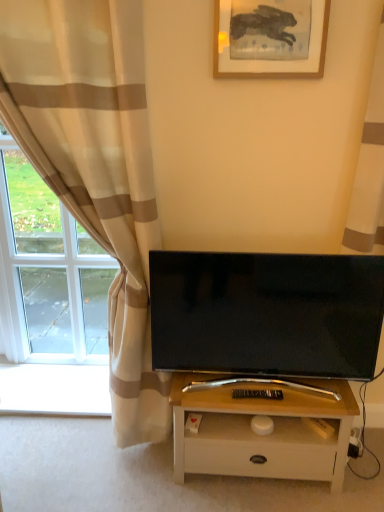
Find the location of a particular element. free space that is in between black glossy tv at center and black plastic remote control at center is located at coordinates (260, 400).